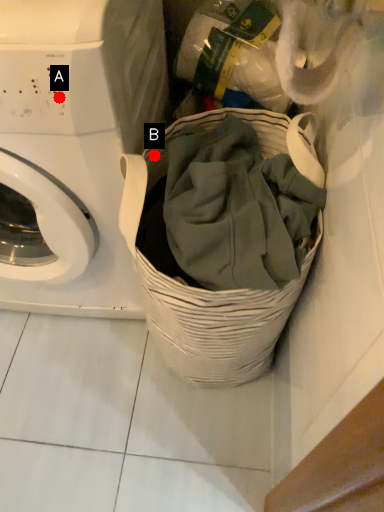
Question: Two points are circled on the image, labeled by A and B beside each circle. Which point is closer to the camera?

Choices:
 (A) A is closer
 (B) B is closer

Answer: (A)